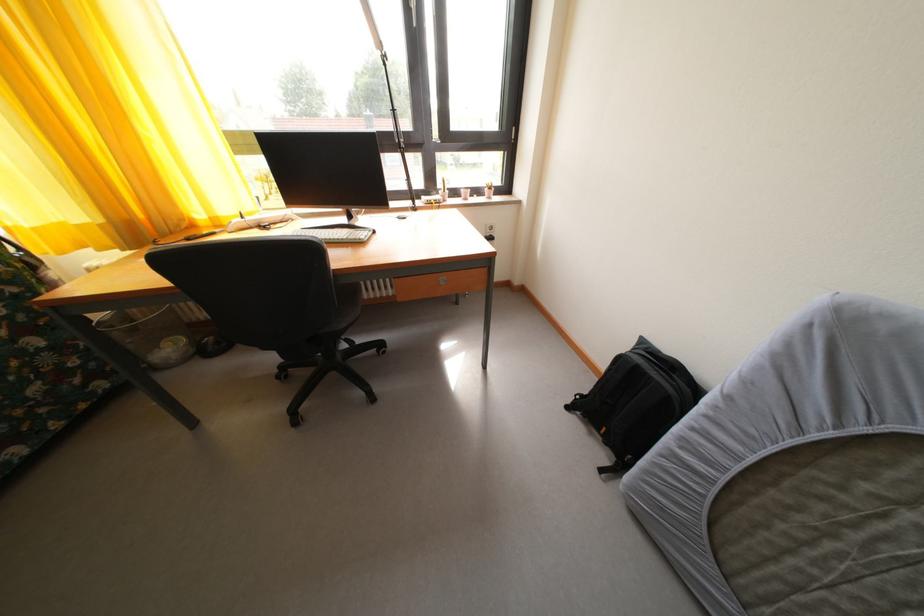
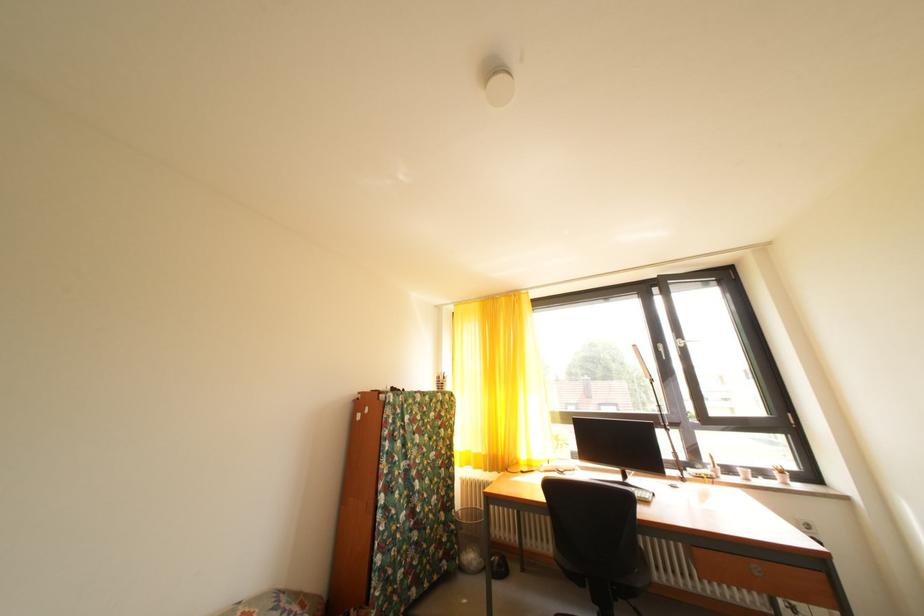
In the second image, find the point that corresponds to point (494, 196) in the first image.

(784, 479)